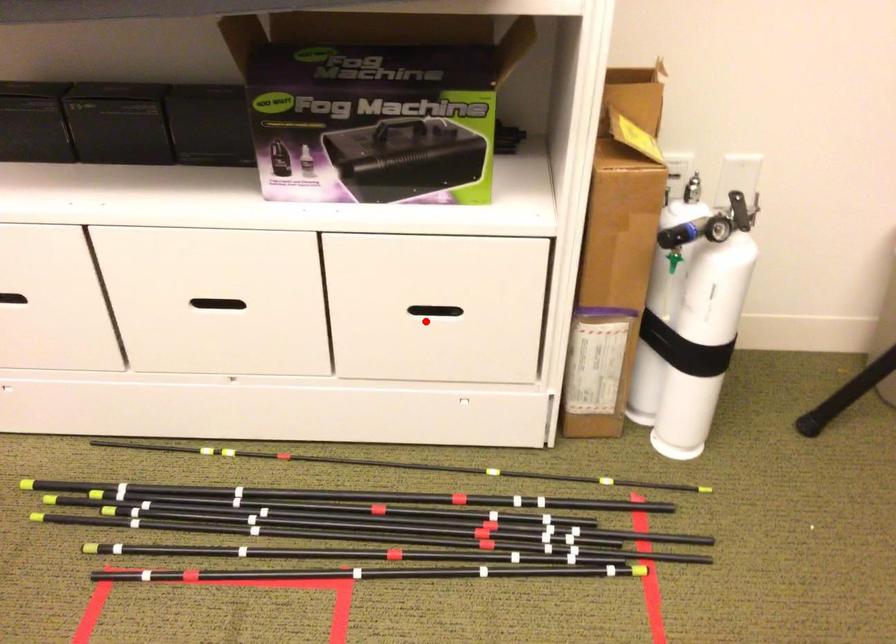
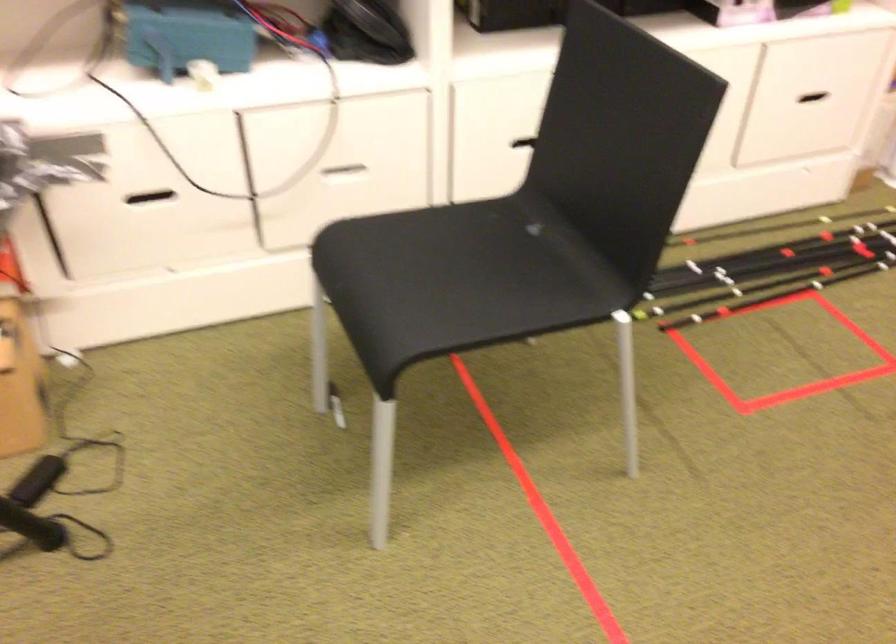
Question: I am providing you with two images of the same scene from different viewpoints. A red point is shown in image1. For the corresponding object point in image2, is it positioned nearer or farther from the camera?

Choices:
 (A) Nearer
 (B) Farther

Answer: (B)